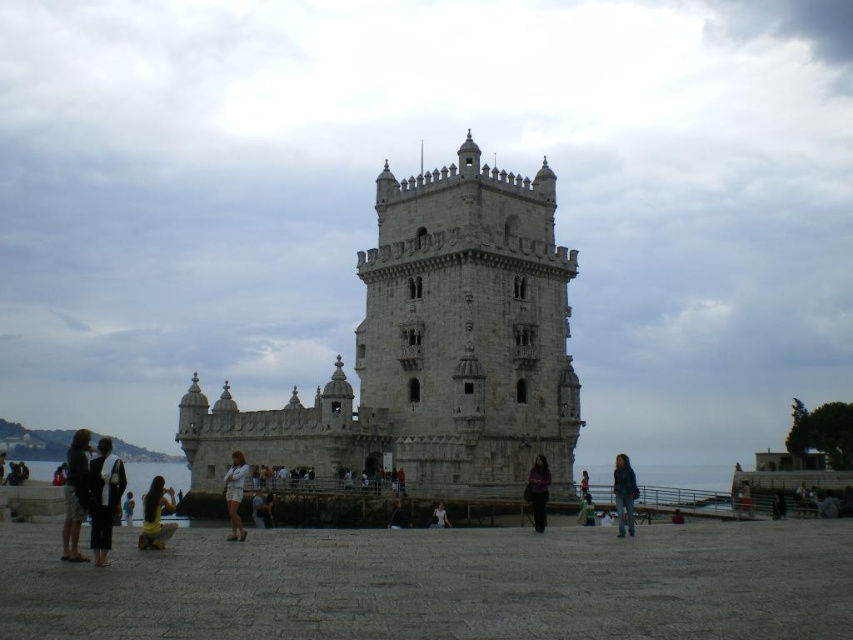
Based on the photo, you are standing at the center of the paved area in front of the historic stone tower. You notice a person wearing dark gray fabric pants at lower left. If you want to approach them, in which direction should you move relative to your current position?

You should move towards the lower left direction to approach the person wearing dark gray fabric pants at lower left since they are located at point (x=103, y=497), which is in the lower left area of the image.

You are a photographer planning to take a portrait of the tourists at the historic stone tower. You notice a person wearing a light brown leather jacket at center and another with light brown hair at center. Which object should you focus on first if you want to capture both in the same frame without adjusting your camera angle?

The light brown leather jacket at center is positioned under the light brown hair at center, so focusing on the light brown hair at center first would ensure both are in the frame without needing to adjust the camera angle.